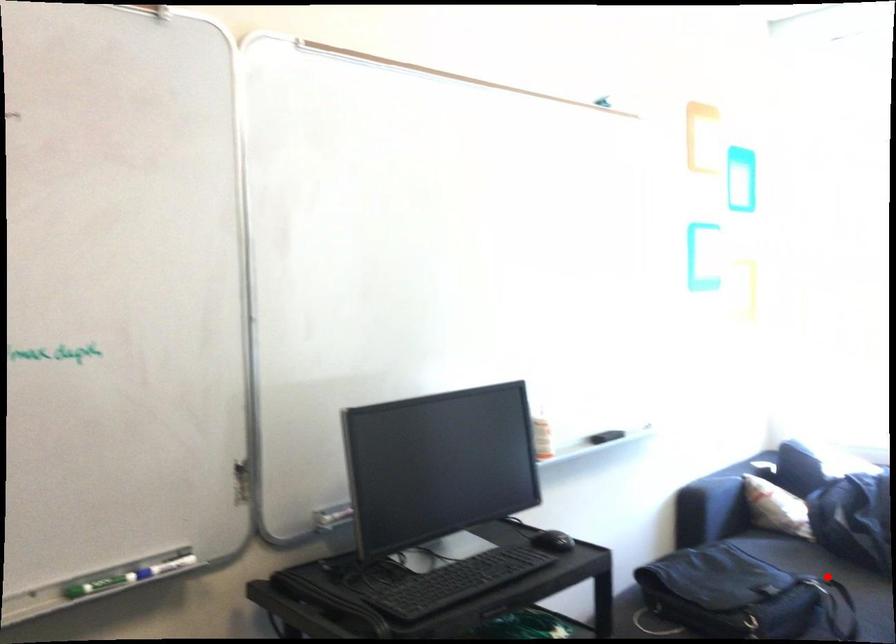
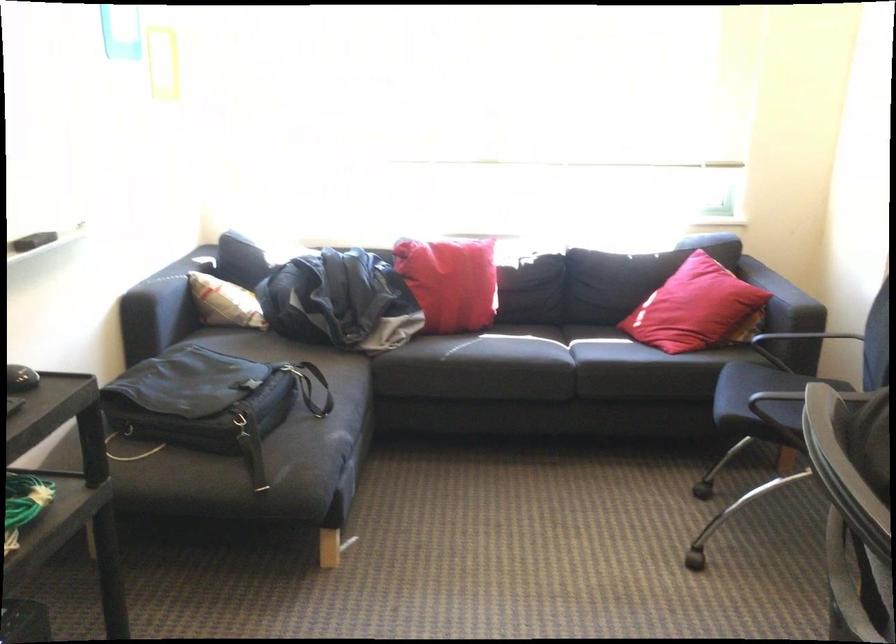
Question: I am providing you with two images of the same scene from different viewpoints. A red point is marked on the first image. At the location where the point appears in image 1, is it still visible in image 2?

Choices:
 (A) Yes
 (B) No

Answer: (B)